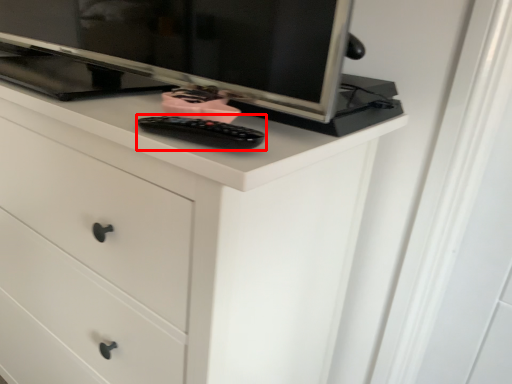
Question: Considering the relative positions of control (annotated by the red box) and chest of drawers in the image provided, where is control (annotated by the red box) located with respect to the staircase?

Choices:
 (A) right
 (B) left

Answer: (A)